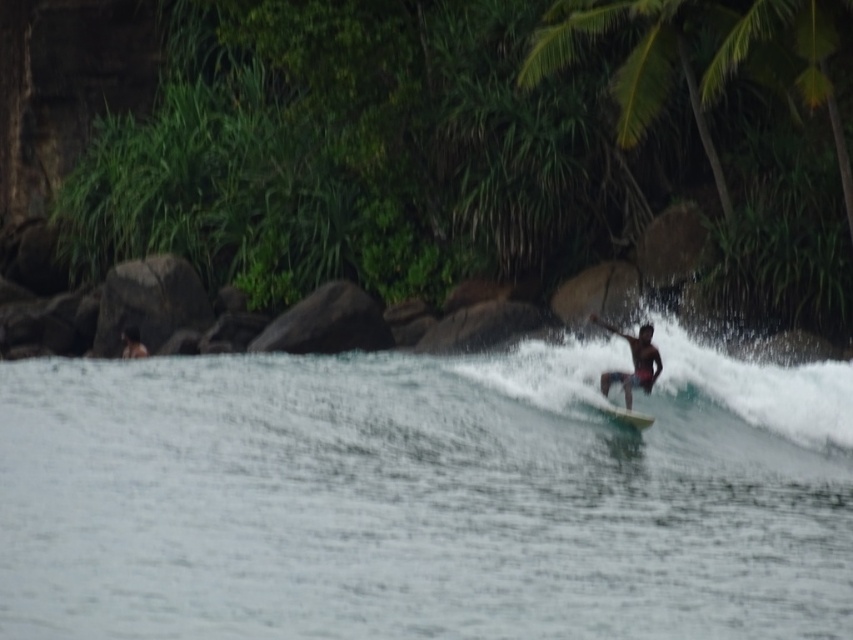
Can you confirm if white smooth wave at center is positioned to the right of smooth gray rock at center?

Indeed, white smooth wave at center is positioned on the right side of smooth gray rock at center.

At what (x,y) coordinates should I click in order to perform the action: click on white smooth wave at center. Please return your answer as a coordinate pair (x, y). The height and width of the screenshot is (640, 853). Looking at the image, I should click on (751, 394).

Which is in front, point (598, 348) or point (358, 300)?

Point (598, 348) is in front.

I want to click on white smooth wave at center, so click(751, 394).

Is clear water at surfboard right to the left of dark brown skin surfer at center from the viewer's perspective?

Correct, you'll find clear water at surfboard right to the left of dark brown skin surfer at center.

Who is more forward, [302,392] or [633,371]?

Point [633,371] is more forward.

Is point (722, 493) farther from camera compared to point (641, 371)?

No, (722, 493) is in front of (641, 371).

The width and height of the screenshot is (853, 640). What are the coordinates of `clear water at surfboard right` in the screenshot? It's located at (424, 497).

Is clear water at surfboard right thinner than white foam surfboard at center?

In fact, clear water at surfboard right might be wider than white foam surfboard at center.

Who is positioned more to the right, clear water at surfboard right or white foam surfboard at center?

white foam surfboard at center is more to the right.

Who is more forward, (x=199, y=372) or (x=627, y=416)?

Positioned in front is point (x=627, y=416).

Locate an element on the screen. The height and width of the screenshot is (640, 853). clear water at surfboard right is located at coordinates (424, 497).